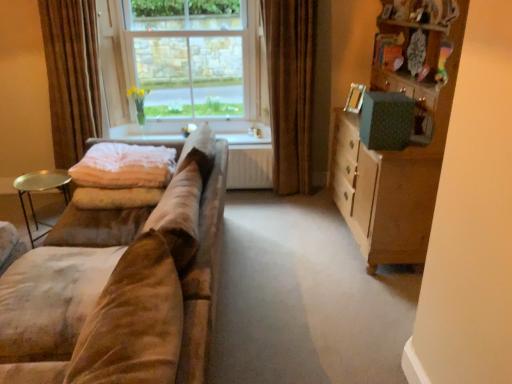
Where is `free space between suede couch at left and wooden cabinet at right`? This screenshot has height=384, width=512. free space between suede couch at left and wooden cabinet at right is located at coordinates (315, 295).